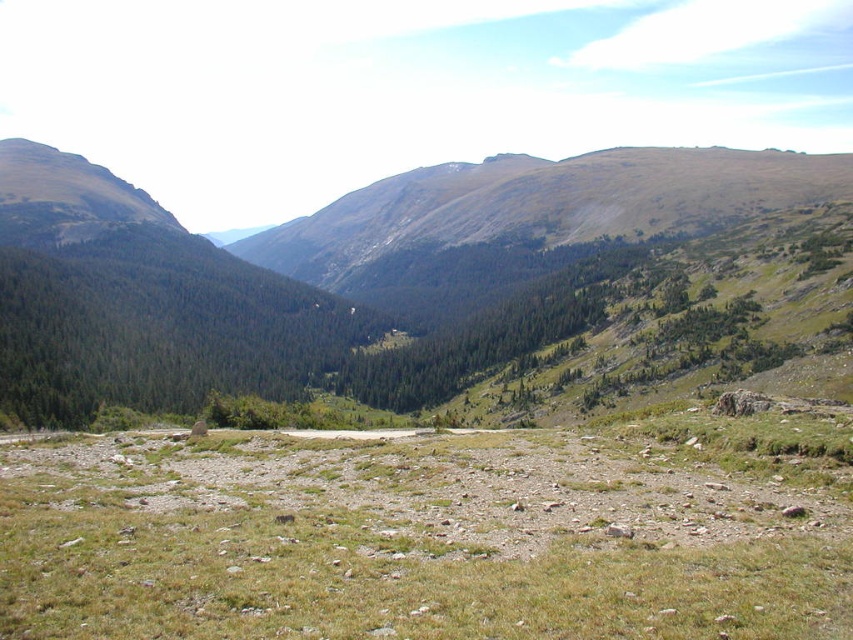
You are a hiker planning to take a photo of the green grassy terrain at center and the green grassy mountain at left. From your current position, which object will appear closer to you in the photo?

The green grassy terrain at center will appear closer to you in the photo because it is positioned in front of the green grassy mountain at left.

You are standing at the point labeled as point (407, 541) in the image. Looking around, what type of terrain are you currently standing on?

You are standing on the green grassy terrain at center, as the point (407, 541) represents this area.